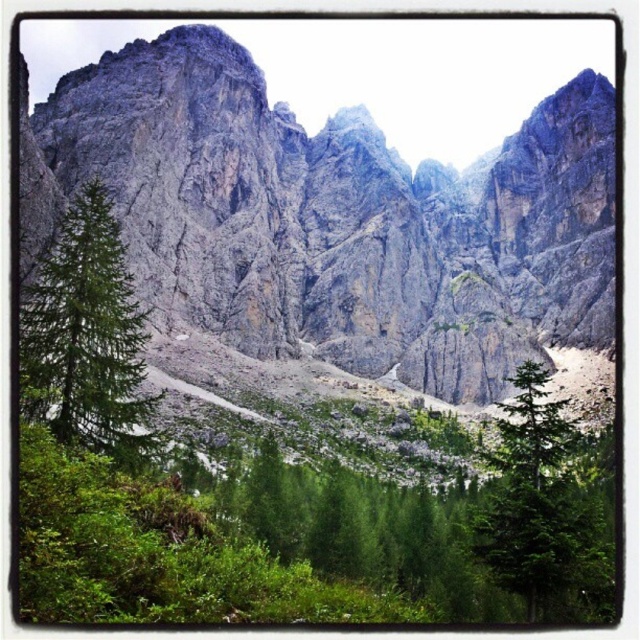
You are a hiker trying to navigate through the dense greenery in this mountainous landscape. You notice two trees, the green matte tree at lower left and the green matte tree at lower right. Which tree would be easier to climb based on their sizes?

The green matte tree at lower left is bigger than the green matte tree at lower right, so it would be easier to climb since larger trees typically have more branches and a sturdier structure for climbing.

Looking at this image, you are standing at the center of the image and want to walk towards the green matte tree at lower left and the green matte tree at lower right. Which direction should you face to walk towards the tree that is higher in the image?

You should face upwards to walk towards the green matte tree at lower left because it is located above the green matte tree at lower right.